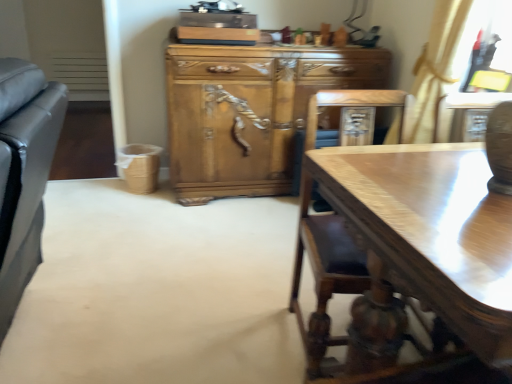
Question: Is light brown wood cabinet at center positioned before glossy wood desk at lower right?

Choices:
 (A) no
 (B) yes

Answer: (A)

Question: Does light brown wood cabinet at center appear on the left side of glossy wood desk at lower right?

Choices:
 (A) yes
 (B) no

Answer: (A)

Question: Does light brown wood cabinet at center have a lesser width compared to glossy wood desk at lower right?

Choices:
 (A) yes
 (B) no

Answer: (B)

Question: From a real-world perspective, does light brown wood cabinet at center sit lower than glossy wood desk at lower right?

Choices:
 (A) no
 (B) yes

Answer: (B)

Question: Is light brown wood cabinet at center at the right side of glossy wood desk at lower right?

Choices:
 (A) no
 (B) yes

Answer: (A)

Question: Is glossy wood desk at lower right a part of light brown wood cabinet at center?

Choices:
 (A) yes
 (B) no

Answer: (B)

Question: From the image's perspective, is glossy wood desk at lower right over light brown wood cabinet at center?

Choices:
 (A) yes
 (B) no

Answer: (B)

Question: From a real-world perspective, does glossy wood desk at lower right stand above light brown wood cabinet at center?

Choices:
 (A) no
 (B) yes

Answer: (B)

Question: Is glossy wood desk at lower right to the left of light brown wood cabinet at center from the viewer's perspective?

Choices:
 (A) no
 (B) yes

Answer: (A)

Question: Is glossy wood desk at lower right taller than light brown wood cabinet at center?

Choices:
 (A) no
 (B) yes

Answer: (A)

Question: Is glossy wood desk at lower right far from light brown wood cabinet at center?

Choices:
 (A) no
 (B) yes

Answer: (B)

Question: Can light brown wood cabinet at center be found inside glossy wood desk at lower right?

Choices:
 (A) no
 (B) yes

Answer: (A)

Question: From the image's perspective, relative to glossy wood desk at lower right, is light brown wood cabinet at center above or below?

Choices:
 (A) above
 (B) below

Answer: (A)